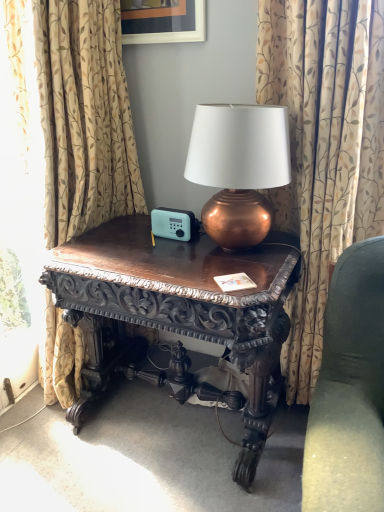
Question: Does dark wood carved table at center touch patterned fabric curtain at center, the second curtain when ordered from left to right?

Choices:
 (A) no
 (B) yes

Answer: (A)

Question: Considering the relative sizes of dark wood carved table at center and patterned fabric curtain at center, the 1th curtain in the right-to-left sequence, in the image provided, is dark wood carved table at center bigger than patterned fabric curtain at center, the 1th curtain in the right-to-left sequence,?

Choices:
 (A) yes
 (B) no

Answer: (A)

Question: Is dark wood carved table at center positioned with its back to patterned fabric curtain at center, the second curtain when ordered from left to right?

Choices:
 (A) no
 (B) yes

Answer: (A)

Question: Can you confirm if dark wood carved table at center is wider than patterned fabric curtain at center, the second curtain when ordered from left to right?

Choices:
 (A) no
 (B) yes

Answer: (B)

Question: Is patterned fabric curtain at center, the 1th curtain in the right-to-left sequence, a part of dark wood carved table at center?

Choices:
 (A) no
 (B) yes

Answer: (A)

Question: From a real-world perspective, is matte black picture frame at upper center physically located above or below beige floral fabric curtain at left, which appears as the 1th curtain when viewed from the left?

Choices:
 (A) above
 (B) below

Answer: (A)

Question: From the image's perspective, is matte black picture frame at upper center located above or below beige floral fabric curtain at left, which appears as the 1th curtain when viewed from the left?

Choices:
 (A) above
 (B) below

Answer: (A)

Question: In the image, is matte black picture frame at upper center positioned in front of or behind beige floral fabric curtain at left, which appears as the 1th curtain when viewed from the left?

Choices:
 (A) front
 (B) behind

Answer: (B)

Question: Is matte black picture frame at upper center taller or shorter than beige floral fabric curtain at left, acting as the second curtain starting from the right?

Choices:
 (A) tall
 (B) short

Answer: (B)

Question: Choose the correct answer: Is dark wood carved table at center inside beige floral fabric curtain at left, which appears as the 1th curtain when viewed from the left, or outside it?

Choices:
 (A) inside
 (B) outside

Answer: (B)

Question: From the image's perspective, is dark wood carved table at center located above or below beige floral fabric curtain at left, which appears as the 1th curtain when viewed from the left?

Choices:
 (A) below
 (B) above

Answer: (A)

Question: From a real-world perspective, is dark wood carved table at center physically located above or below beige floral fabric curtain at left, acting as the second curtain starting from the right?

Choices:
 (A) above
 (B) below

Answer: (B)

Question: Considering the positions of point (223, 252) and point (9, 9), is point (223, 252) closer or farther from the camera than point (9, 9)?

Choices:
 (A) closer
 (B) farther

Answer: (A)

Question: Looking at their shapes, would you say matte black picture frame at upper center is wider or thinner than dark wood carved table at center?

Choices:
 (A) wide
 (B) thin

Answer: (B)

Question: Based on their sizes in the image, would you say matte black picture frame at upper center is bigger or smaller than dark wood carved table at center?

Choices:
 (A) small
 (B) big

Answer: (A)